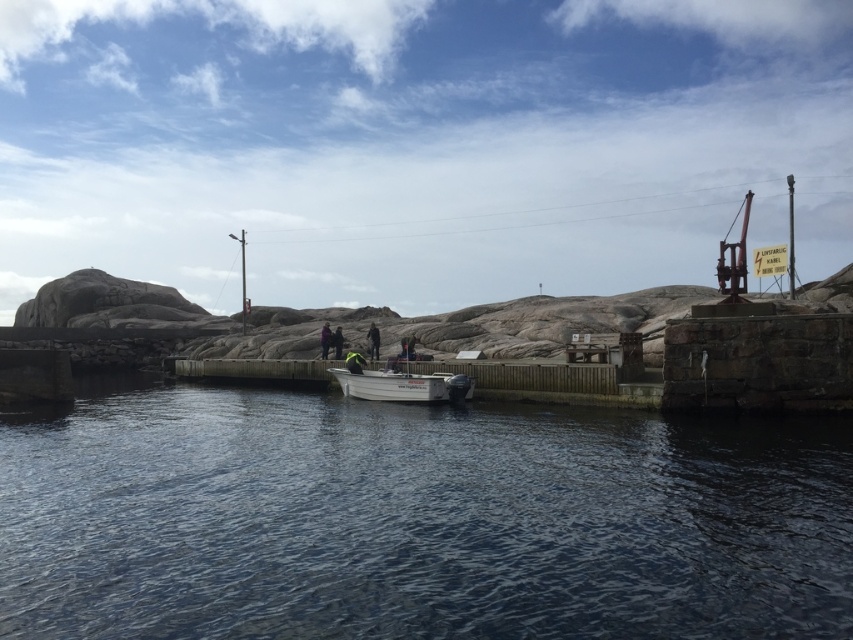
Is white matte boat at center above dark blue jacket at center?

No.

Which is below, white matte boat at center or dark blue jacket at center?

Positioned lower is white matte boat at center.

I want to click on white matte boat at center, so click(401, 384).

Find the location of a particular element. white matte boat at center is located at coordinates (401, 384).

Measure the distance from dark blue water at center to dark green fabric jacket at center.

They are 27.20 meters apart.

Between dark blue water at center and dark green fabric jacket at center, which one has less height?

dark green fabric jacket at center is shorter.

Measure the distance between point (229, 392) and camera.

69.32 meters

The image size is (853, 640). I want to click on dark blue water at center, so click(416, 520).

Does white matte boat at center have a greater width compared to dark green fabric jacket at center?

Correct, the width of white matte boat at center exceeds that of dark green fabric jacket at center.

How much distance is there between white matte boat at center and dark green fabric jacket at center?

white matte boat at center and dark green fabric jacket at center are 7.15 meters apart from each other.

Is point (448, 401) positioned behind point (366, 333)?

No, (448, 401) is closer to viewer.

Locate an element on the screen. white matte boat at center is located at coordinates (401, 384).